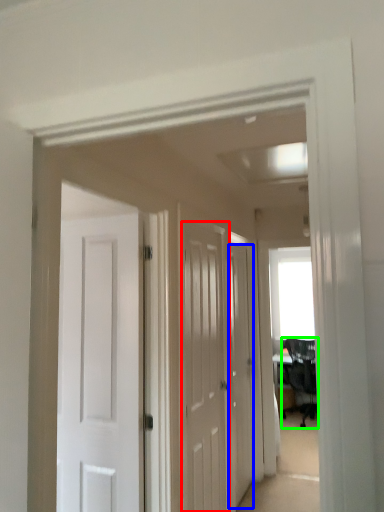
Question: Which object is the closest to the door (highlighted by a red box)? Choose among these: door (highlighted by a blue box) or chair (highlighted by a green box).

Choices:
 (A) door
 (B) chair

Answer: (A)